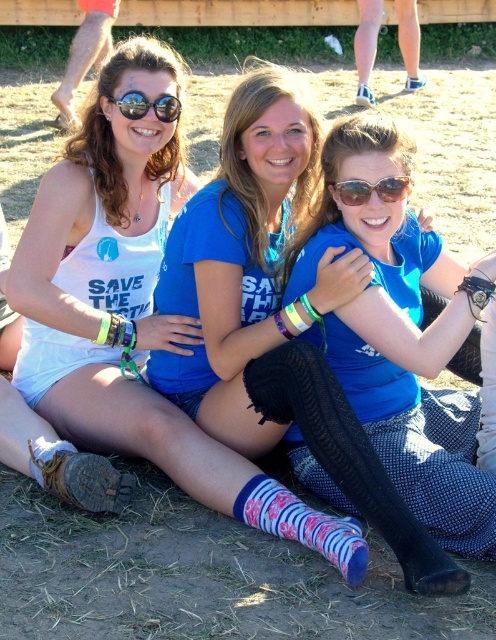
You are a photographer trying to capture a closeup of the blue cotton shirt at center and the black reflective sunglasses at upper center. Which object should you focus on first if you want to ensure both are in focus?

The blue cotton shirt at center is located below the black reflective sunglasses at upper center, so you should focus on the black reflective sunglasses at upper center first to ensure both are in focus.